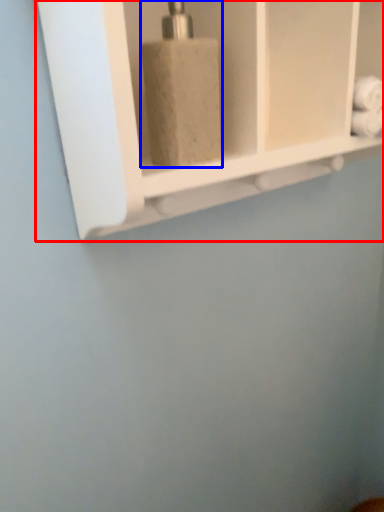
Question: Which object is further to the camera taking this photo, shelf (highlighted by a red box) or soap dispenser (highlighted by a blue box)?

Choices:
 (A) shelf
 (B) soap dispenser

Answer: (B)